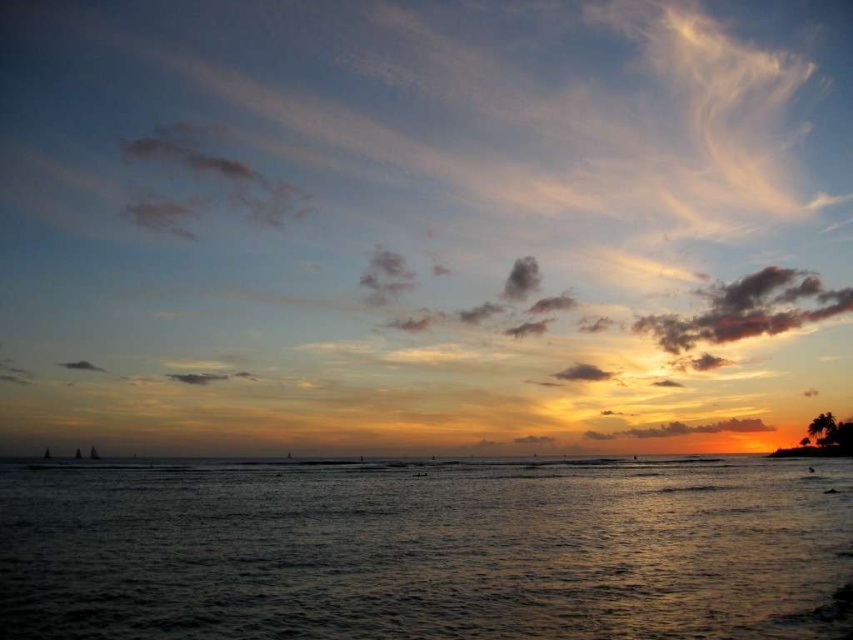
Which is above, cloudy sky at upper center or golden-orange cotton cloud at lower right?

cloudy sky at upper center is higher up.

Find the location of a particular element. cloudy sky at upper center is located at coordinates 422,221.

Between cloudy sky at upper center and smokey gray cloud at upper left, which one has less height?

With less height is smokey gray cloud at upper left.

What do you see at coordinates (422, 221) in the screenshot? The height and width of the screenshot is (640, 853). I see `cloudy sky at upper center` at bounding box center [422, 221].

You are a GUI agent. You are given a task and a screenshot of the screen. Output one action in this format:
    pyautogui.click(x=<x>, y=<y>)
    Task: Click on the cloudy sky at upper center
    This screenshot has height=640, width=853.
    Given the screenshot: What is the action you would take?
    point(422,221)

What do you see at coordinates (422, 548) in the screenshot? I see `dark water at center` at bounding box center [422, 548].

Does dark water at center have a lesser width compared to smokey gray cloud at upper left?

No, dark water at center is not thinner than smokey gray cloud at upper left.

Locate an element on the screen. dark water at center is located at coordinates (422, 548).

Locate an element on the screen. The width and height of the screenshot is (853, 640). dark water at center is located at coordinates (422, 548).